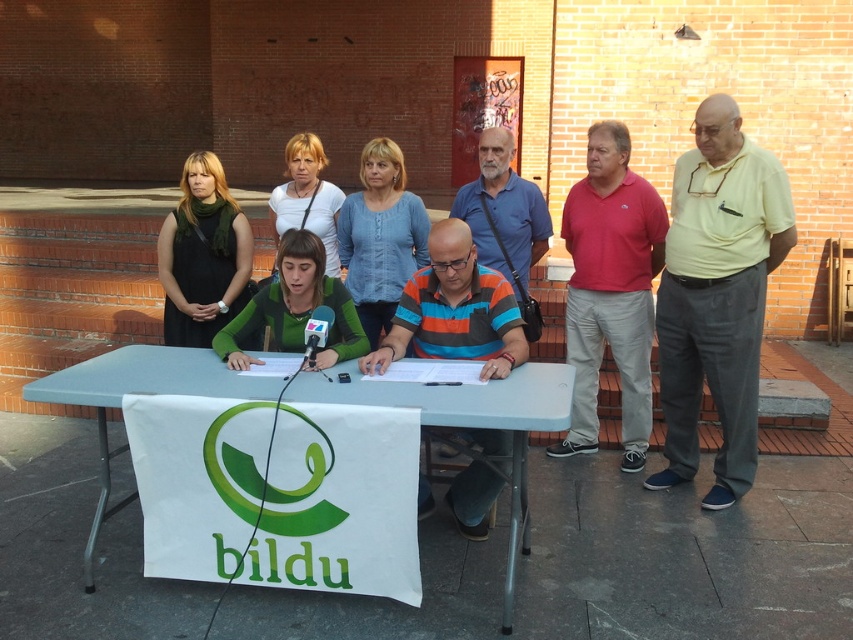
Can you confirm if white plastic table at center is shorter than striped cotton shirt at center?

Incorrect, white plastic table at center's height does not fall short of striped cotton shirt at center's.

Who is more forward, (107, 451) or (473, 476)?

Point (107, 451) is more forward.

Locate an element on the screen. This screenshot has width=853, height=640. white plastic table at center is located at coordinates (474, 426).

Who is positioned more to the right, matte black dress at left or metallic silver microphone at center?

From the viewer's perspective, metallic silver microphone at center appears more on the right side.

Can you confirm if matte black dress at left is bigger than metallic silver microphone at center?

Yes, matte black dress at left is bigger than metallic silver microphone at center.

Find the location of a particular element. Image resolution: width=853 pixels, height=640 pixels. matte black dress at left is located at coordinates (202, 256).

Is point (329, 200) behind point (318, 307)?

Yes, it is behind point (318, 307).

Which is below, matte white shirt at center or metallic silver microphone at center?

metallic silver microphone at center

Does point (283, 200) come closer to viewer compared to point (303, 355)?

No, it is behind (303, 355).

Where is `matte white shirt at center`? matte white shirt at center is located at coordinates (306, 196).